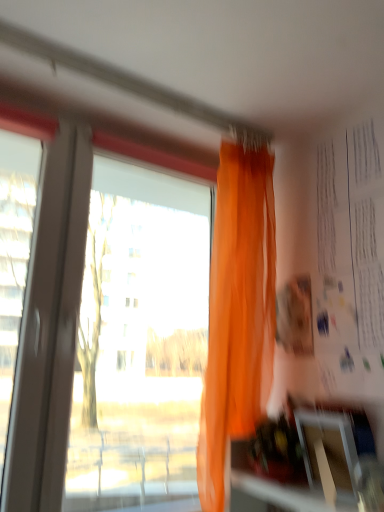
Question: From the image's perspective, does white paper at upper right appear lower than orange sheer curtain at upper center?

Choices:
 (A) yes
 (B) no

Answer: (B)

Question: Is white paper at upper right looking in the opposite direction of orange sheer curtain at upper center?

Choices:
 (A) yes
 (B) no

Answer: (B)

Question: Considering the relative sizes of white paper at upper right and orange sheer curtain at upper center in the image provided, is white paper at upper right smaller than orange sheer curtain at upper center?

Choices:
 (A) no
 (B) yes

Answer: (B)

Question: Is white paper at upper right at the left side of orange sheer curtain at upper center?

Choices:
 (A) yes
 (B) no

Answer: (B)

Question: Is white paper at upper right to the right of orange sheer curtain at upper center from the viewer's perspective?

Choices:
 (A) yes
 (B) no

Answer: (A)

Question: Is white paper at upper right shorter than orange sheer curtain at upper center?

Choices:
 (A) no
 (B) yes

Answer: (B)

Question: Is transparent plastic window screen at lower right far from orange sheer curtain at upper center?

Choices:
 (A) yes
 (B) no

Answer: (B)

Question: Is transparent plastic window screen at lower right to the left of orange sheer curtain at upper center from the viewer's perspective?

Choices:
 (A) no
 (B) yes

Answer: (A)

Question: Is orange sheer curtain at upper center a part of transparent plastic window screen at lower right?

Choices:
 (A) yes
 (B) no

Answer: (B)

Question: From a real-world perspective, is transparent plastic window screen at lower right below orange sheer curtain at upper center?

Choices:
 (A) yes
 (B) no

Answer: (A)

Question: Is transparent plastic window screen at lower right positioned with its back to orange sheer curtain at upper center?

Choices:
 (A) no
 (B) yes

Answer: (A)

Question: Is transparent plastic window screen at lower right shorter than orange sheer curtain at upper center?

Choices:
 (A) no
 (B) yes

Answer: (B)

Question: Considering the relative sizes of orange sheer curtain at upper center and white paper at upper right in the image provided, is orange sheer curtain at upper center thinner than white paper at upper right?

Choices:
 (A) yes
 (B) no

Answer: (B)